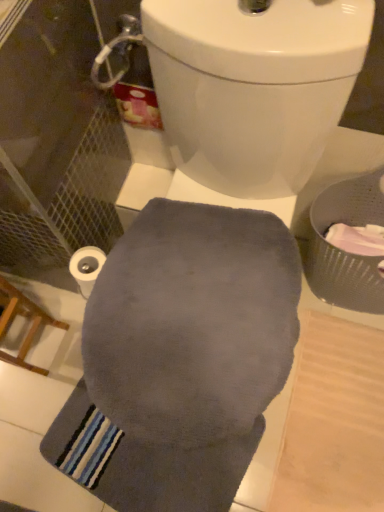
Question: Considering their positions, is wooden chair at lower left located in front of or behind gray soft towel at center?

Choices:
 (A) front
 (B) behind

Answer: (A)

Question: From the image's perspective, is wooden chair at lower left located above or below gray soft towel at center?

Choices:
 (A) above
 (B) below

Answer: (A)

Question: Considering the real-world distances, which object is closest to the gray soft towel at center?

Choices:
 (A) white matte toilet paper at lower left
 (B) wooden chair at lower left
 (C) gray woven basket at right

Answer: (B)

Question: Estimate the real-world distances between objects in this image. Which object is farther from the gray soft towel at center?

Choices:
 (A) white matte toilet paper at lower left
 (B) wooden chair at lower left
 (C) gray woven basket at right

Answer: (C)